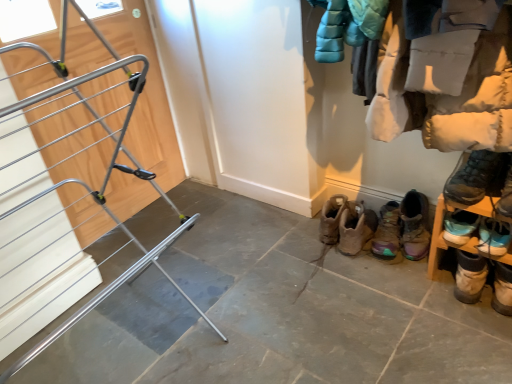
Locate an element on the screen. The image size is (512, 384). free space in front of brown suede boot at lower right, which is counted as the sixth footwear, starting from the right is located at coordinates (370, 276).